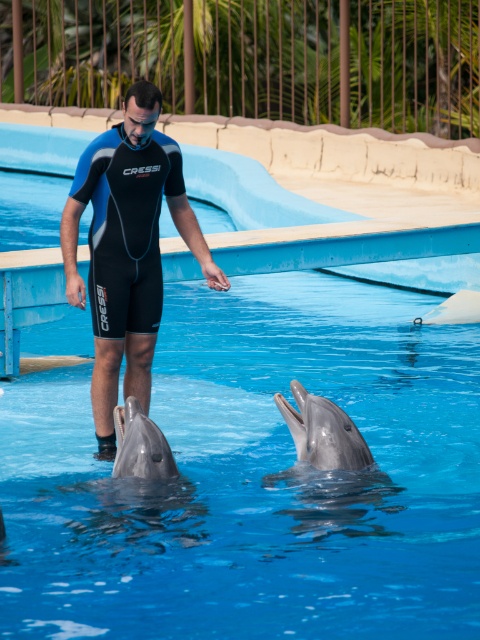
Can you confirm if blue neoprene wetsuit at center is taller than black neoprene wetsuit at center?

Yes, blue neoprene wetsuit at center is taller than black neoprene wetsuit at center.

What do you see at coordinates (128, 248) in the screenshot? I see `blue neoprene wetsuit at center` at bounding box center [128, 248].

Describe the element at coordinates (128, 248) in the screenshot. I see `blue neoprene wetsuit at center` at that location.

Locate an element on the screen. The image size is (480, 640). blue neoprene wetsuit at center is located at coordinates (128, 248).

Does blue neoprene wetsuit at center appear on the right side of gray matte dolphin at lower center?

In fact, blue neoprene wetsuit at center is to the left of gray matte dolphin at lower center.

Which of these two, blue neoprene wetsuit at center or gray matte dolphin at lower center, stands shorter?

With less height is gray matte dolphin at lower center.

Based on the photo, who is more distant from viewer, (x=69, y=288) or (x=137, y=404)?

Positioned behind is point (x=69, y=288).

The image size is (480, 640). Find the location of `blue neoprene wetsuit at center`. blue neoprene wetsuit at center is located at coordinates [x=128, y=248].

Can you confirm if black neoprene wetsuit at center is shorter than gray matte dolphin at lower center?

No, black neoprene wetsuit at center is not shorter than gray matte dolphin at lower center.

Can you confirm if black neoprene wetsuit at center is positioned below gray matte dolphin at lower center?

No.

Locate an element on the screen. The image size is (480, 640). black neoprene wetsuit at center is located at coordinates (126, 227).